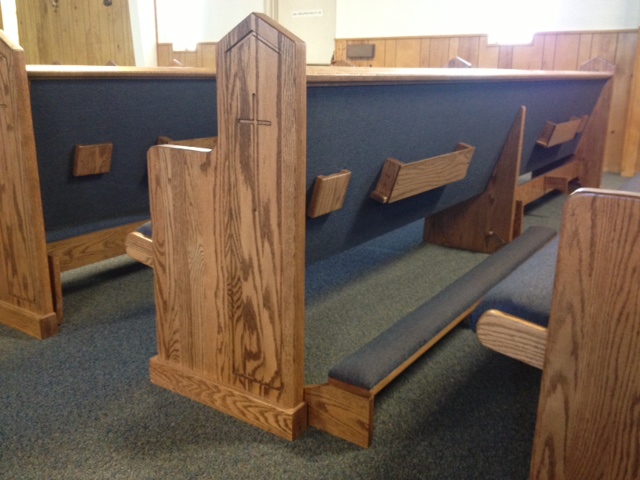
Identify the location of green colored pew backs. The height and width of the screenshot is (480, 640). coord(363,125), coord(100,99), coord(550,96).